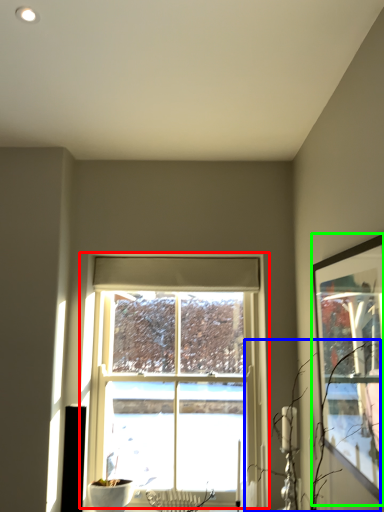
Question: Considering the real-world distances, which object is farthest from window (highlighted by a red box)? branch (highlighted by a blue box) or picture frame (highlighted by a green box)?

Choices:
 (A) branch
 (B) picture frame

Answer: (B)